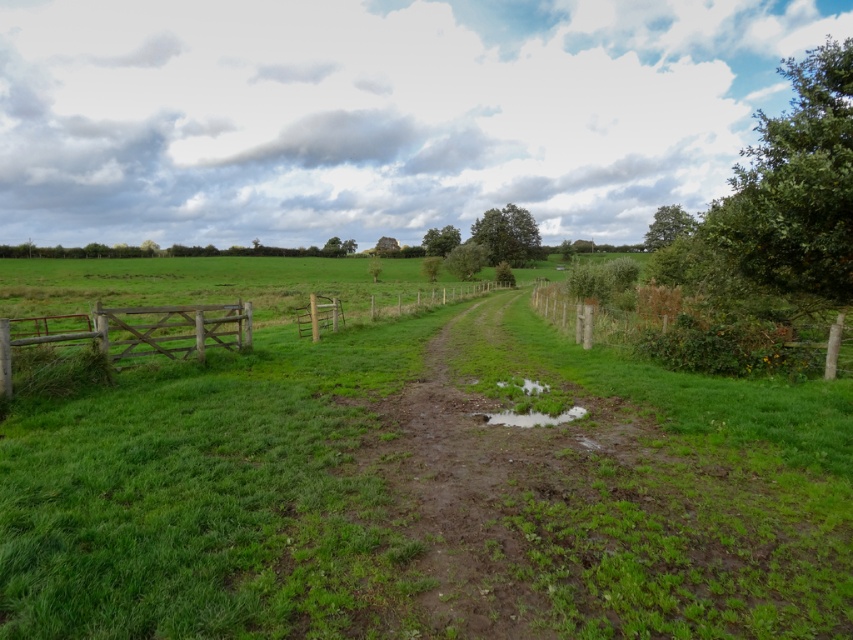
You are standing at the starting point of the dirt path and want to walk towards the green grassy at center. In which direction should you head?

You should head towards the center of the image, where the green grassy at center is located at point coordinates approximately 0.750 on the x axis and 0.483 on the y axis.

You are standing at the point with coordinates point (326, 307) and want to walk towards the point with coordinates point (582, 410). Since you can only move along the dirt path, which direction should you face to move towards the desired point?

You should face away from the viewer because point (326, 307) is closer to you than point (582, 410), so moving in that direction would take you further away from the viewer towards the desired point.